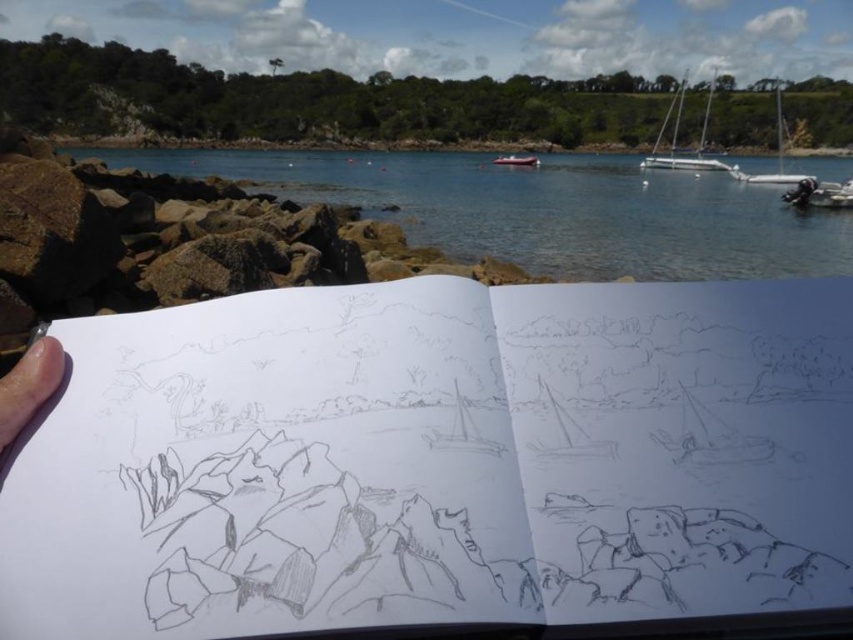
Question: Among these objects, which one is farthest from the camera?

Choices:
 (A) metallic red boat at center
 (B) white sailboat at upper right
 (C) pencil sketchbook at center
 (D) white glossy sailboat at upper right

Answer: (D)

Question: Is skin/soft/hand at lower left below metallic red boat at center?

Choices:
 (A) yes
 (B) no

Answer: (A)

Question: Which point appears farthest from the camera in this image?

Choices:
 (A) (505, 161)
 (B) (781, 141)
 (C) (347, 168)

Answer: (B)

Question: Which point is farther to the camera?

Choices:
 (A) (785, 182)
 (B) (665, 113)

Answer: (A)

Question: Is pencil sketchbook at center positioned behind white sailboat at upper right?

Choices:
 (A) no
 (B) yes

Answer: (A)

Question: Is the position of clear blue water at center less distant than that of white glossy sailboat at upper right?

Choices:
 (A) yes
 (B) no

Answer: (A)